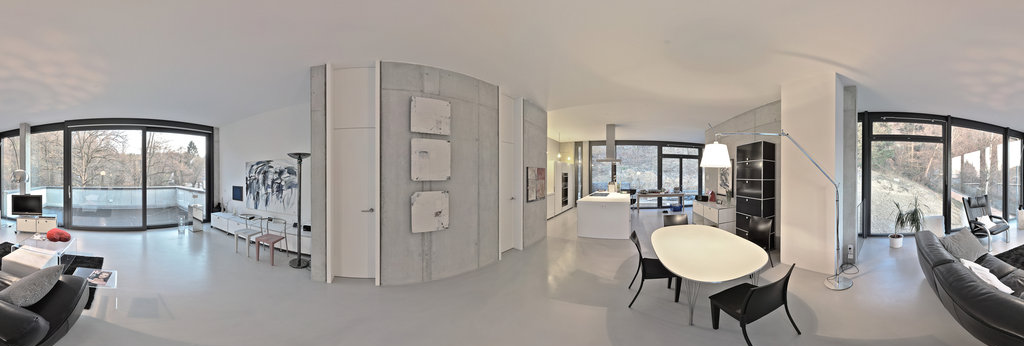
Locate an element on the screen. picture is located at coordinates coord(532,183).